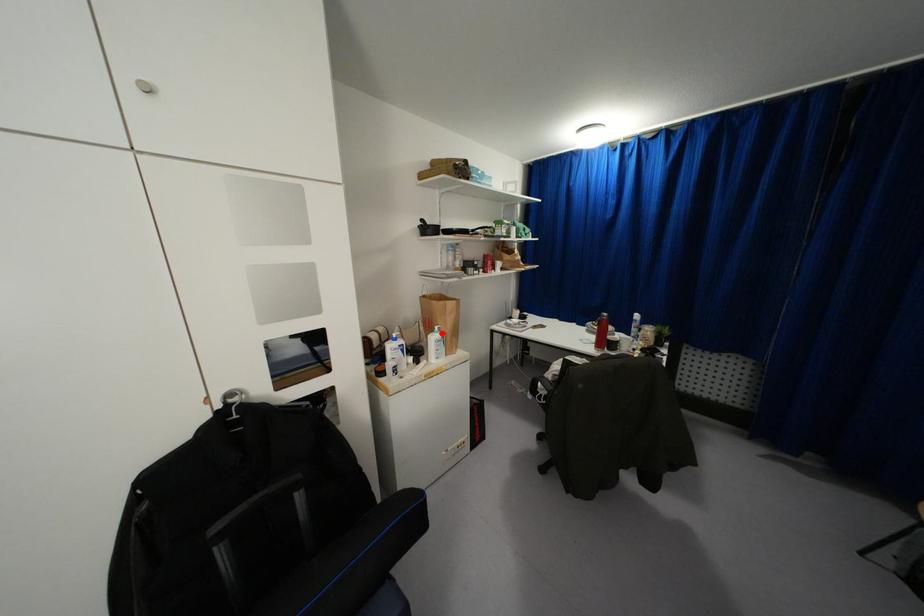
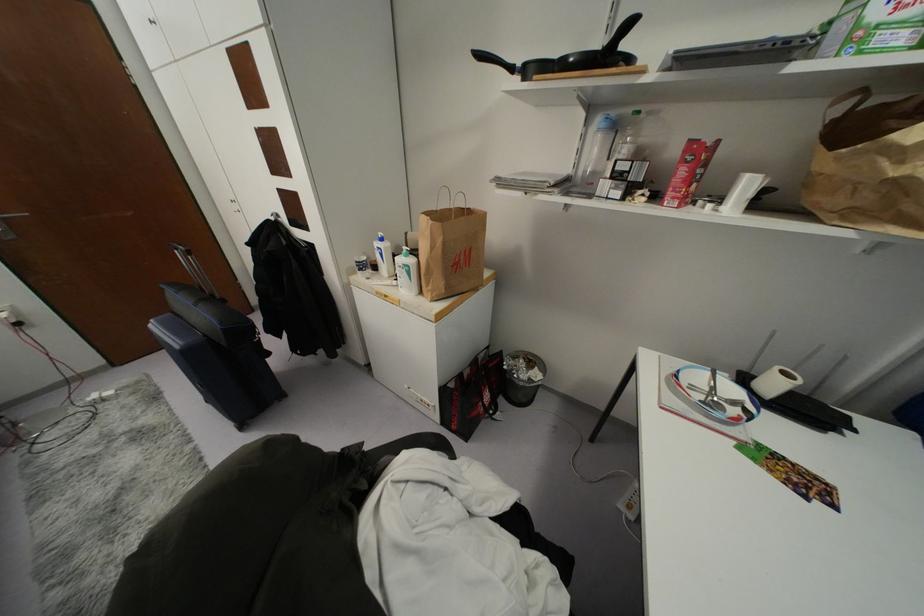
The point at the highlighted location is marked in the first image. Where is the corresponding point in the second image?

(410, 261)